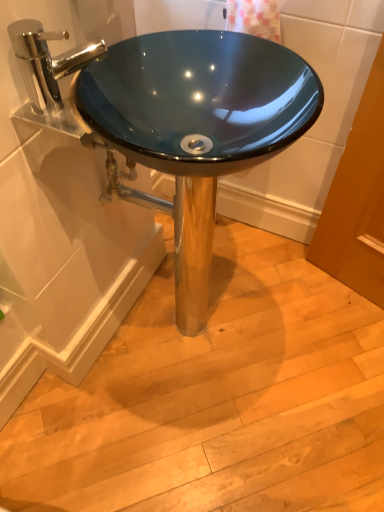
Where is `glossy blue glass sink at center`? glossy blue glass sink at center is located at coordinates (173, 122).

In the scene shown: Measure the distance between glossy blue glass sink at center and camera.

24.59 inches.

Describe the element at coordinates (173, 122) in the screenshot. The height and width of the screenshot is (512, 384). I see `glossy blue glass sink at center` at that location.

Image resolution: width=384 pixels, height=512 pixels. What do you see at coordinates (48, 61) in the screenshot? I see `polished chrome faucet at upper left` at bounding box center [48, 61].

You are a GUI agent. You are given a task and a screenshot of the screen. Output one action in this format:
    pyautogui.click(x=<x>, y=<y>)
    Task: Click on the polished chrome faucet at upper left
    The width and height of the screenshot is (384, 512).
    Given the screenshot: What is the action you would take?
    pyautogui.click(x=48, y=61)

You are a GUI agent. You are given a task and a screenshot of the screen. Output one action in this format:
    pyautogui.click(x=<x>, y=<y>)
    Task: Click on the glossy blue glass sink at center
    
    Given the screenshot: What is the action you would take?
    pyautogui.click(x=173, y=122)

Is glossy blue glass sink at center at the right side of polished chrome faucet at upper left?

Yes.

Considering the positions of objects glossy blue glass sink at center and polished chrome faucet at upper left in the image provided, who is behind, glossy blue glass sink at center or polished chrome faucet at upper left?

glossy blue glass sink at center.

Which is farther, [193,150] or [26,81]?

The point [193,150] is farther from the camera.

From the image's perspective, is glossy blue glass sink at center located beneath polished chrome faucet at upper left?

Yes, from the image's perspective, glossy blue glass sink at center is below polished chrome faucet at upper left.

From a real-world perspective, is glossy blue glass sink at center positioned over polished chrome faucet at upper left based on gravity?

Incorrect, from a real-world perspective, glossy blue glass sink at center is lower than polished chrome faucet at upper left.

Which of these two, glossy blue glass sink at center or polished chrome faucet at upper left, is thinner?

With smaller width is polished chrome faucet at upper left.

Considering the sizes of glossy blue glass sink at center and polished chrome faucet at upper left in the image, is glossy blue glass sink at center taller or shorter than polished chrome faucet at upper left?

glossy blue glass sink at center is taller than polished chrome faucet at upper left.

Is glossy blue glass sink at center smaller than polished chrome faucet at upper left?

Incorrect, glossy blue glass sink at center is not smaller in size than polished chrome faucet at upper left.

Is glossy blue glass sink at center not within polished chrome faucet at upper left?

Yes, glossy blue glass sink at center is not within polished chrome faucet at upper left.

Is glossy blue glass sink at center touching polished chrome faucet at upper left?

No, glossy blue glass sink at center is not with polished chrome faucet at upper left.

Is glossy blue glass sink at center turned away from polished chrome faucet at upper left?

glossy blue glass sink at center is not turned away from polished chrome faucet at upper left.

How much distance is there between glossy blue glass sink at center and polished chrome faucet at upper left?

glossy blue glass sink at center is 9.34 inches from polished chrome faucet at upper left.

Where is `sink lying on the right of polished chrome faucet at upper left`? The image size is (384, 512). sink lying on the right of polished chrome faucet at upper left is located at coordinates (173, 122).

Which object is positioned more to the left, polished chrome faucet at upper left or glossy blue glass sink at center?

polished chrome faucet at upper left is more to the left.

Is polished chrome faucet at upper left further to camera compared to glossy blue glass sink at center?

No, polished chrome faucet at upper left is closer to the camera.

Does point (31, 103) appear closer or farther from the camera than point (85, 77)?

Point (31, 103) appears to be closer to the viewer than point (85, 77).

From the image's perspective, between polished chrome faucet at upper left and glossy blue glass sink at center, who is located below?

glossy blue glass sink at center appears lower in the image.

From a real-world perspective, relative to glossy blue glass sink at center, is polished chrome faucet at upper left vertically above or below?

polished chrome faucet at upper left is situated higher than glossy blue glass sink at center in the real world.

Considering the sizes of objects polished chrome faucet at upper left and glossy blue glass sink at center in the image provided, who is thinner, polished chrome faucet at upper left or glossy blue glass sink at center?

Thinner between the two is polished chrome faucet at upper left.

Consider the image. Can you confirm if polished chrome faucet at upper left is shorter than glossy blue glass sink at center?

Yes.

Is polished chrome faucet at upper left bigger or smaller than glossy blue glass sink at center?

Clearly, polished chrome faucet at upper left is smaller in size than glossy blue glass sink at center.

Choose the correct answer: Is polished chrome faucet at upper left inside glossy blue glass sink at center or outside it?

polished chrome faucet at upper left is located beyond the bounds of glossy blue glass sink at center.

Is polished chrome faucet at upper left not close to glossy blue glass sink at center?

Actually, polished chrome faucet at upper left and glossy blue glass sink at center are a little close together.

In the scene shown: Is polished chrome faucet at upper left oriented away from glossy blue glass sink at center?

That's not correct — polished chrome faucet at upper left is not looking away from glossy blue glass sink at center.

How much distance is there between polished chrome faucet at upper left and glossy blue glass sink at center?

polished chrome faucet at upper left is 23.73 centimeters away from glossy blue glass sink at center.

I want to click on tap lying in front of the glossy blue glass sink at center, so click(48, 61).

I want to click on sink that appears behind the polished chrome faucet at upper left, so click(173, 122).

Identify the location of tap above the glossy blue glass sink at center (from a real-world perspective). The height and width of the screenshot is (512, 384). (48, 61).